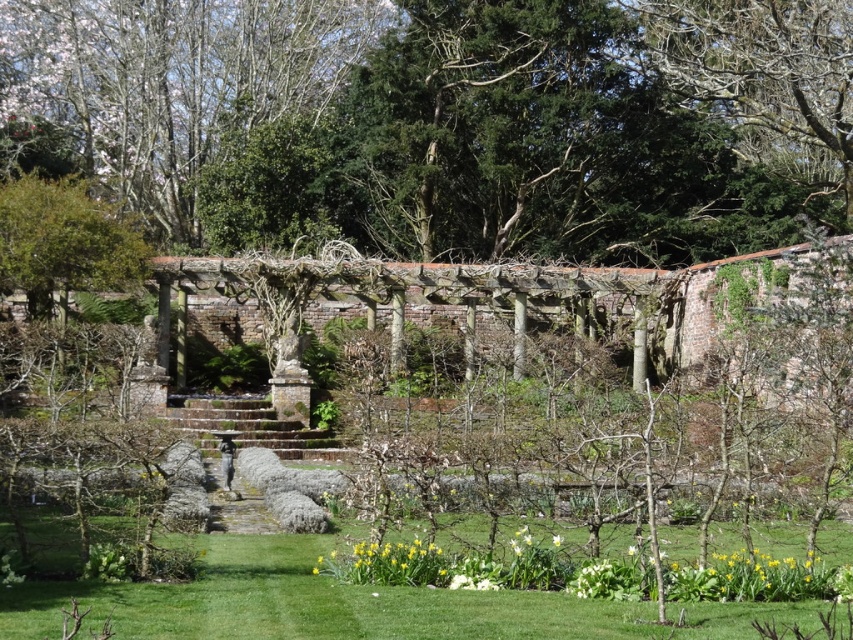
Question: Considering the relative positions of green leafy tree at upper right and yellow matte daffodil at lower center in the image provided, where is green leafy tree at upper right located with respect to yellow matte daffodil at lower center?

Choices:
 (A) left
 (B) right

Answer: (B)

Question: Among these objects, which one is nearest to the camera?

Choices:
 (A) green grass at center
 (B) green leafy tree at upper right
 (C) yellow matte daffodil at lower center

Answer: (A)

Question: Is green grass at center to the right of white matte flower at center from the viewer's perspective?

Choices:
 (A) no
 (B) yes

Answer: (A)

Question: Which point appears closest to the camera in this image?

Choices:
 (A) (810, 154)
 (B) (306, 595)
 (C) (111, 64)
 (D) (560, 541)

Answer: (B)

Question: Estimate the real-world distances between objects in this image. Which object is farther from the green leafy tree at upper right?

Choices:
 (A) smooth bark tree at upper left
 (B) yellow matte daffodil at lower center
 (C) green grass at center

Answer: (B)

Question: Is green grass at center behind green leafy tree at upper right?

Choices:
 (A) yes
 (B) no

Answer: (B)